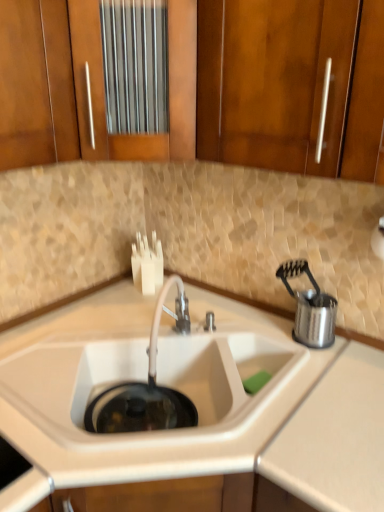
Question: Does satin nickel faucet at center have a lesser width compared to stainless steel utensil holder at right?

Choices:
 (A) yes
 (B) no

Answer: (B)

Question: Is the depth of satin nickel faucet at center less than that of stainless steel utensil holder at right?

Choices:
 (A) yes
 (B) no

Answer: (A)

Question: Would you say satin nickel faucet at center is outside stainless steel utensil holder at right?

Choices:
 (A) no
 (B) yes

Answer: (B)

Question: Considering the relative sizes of satin nickel faucet at center and stainless steel utensil holder at right in the image provided, is satin nickel faucet at center taller than stainless steel utensil holder at right?

Choices:
 (A) no
 (B) yes

Answer: (A)

Question: Does satin nickel faucet at center have a larger size compared to stainless steel utensil holder at right?

Choices:
 (A) no
 (B) yes

Answer: (A)

Question: Does satin nickel faucet at center have a greater width compared to stainless steel utensil holder at right?

Choices:
 (A) no
 (B) yes

Answer: (B)

Question: Is wooden cabinet at upper left, the first cabinetry viewed from the left, outside satin nickel faucet at center?

Choices:
 (A) yes
 (B) no

Answer: (A)

Question: Is wooden cabinet at upper left, the second cabinetry when ordered from right to left, positioned with its back to satin nickel faucet at center?

Choices:
 (A) yes
 (B) no

Answer: (B)

Question: From the image's perspective, would you say wooden cabinet at upper left, the second cabinetry when ordered from right to left, is shown under satin nickel faucet at center?

Choices:
 (A) no
 (B) yes

Answer: (A)

Question: Are wooden cabinet at upper left, the first cabinetry viewed from the left, and satin nickel faucet at center located far from each other?

Choices:
 (A) no
 (B) yes

Answer: (A)

Question: From the image's perspective, is wooden cabinet at upper left, the second cabinetry when ordered from right to left, on top of satin nickel faucet at center?

Choices:
 (A) yes
 (B) no

Answer: (A)

Question: From a real-world perspective, is wooden cabinet at upper left, the second cabinetry when ordered from right to left, physically below satin nickel faucet at center?

Choices:
 (A) yes
 (B) no

Answer: (B)

Question: Can you confirm if stainless steel utensil holder at right is wider than wooden cabinet at upper center, marked as the first cabinetry in a right-to-left arrangement?

Choices:
 (A) no
 (B) yes

Answer: (A)